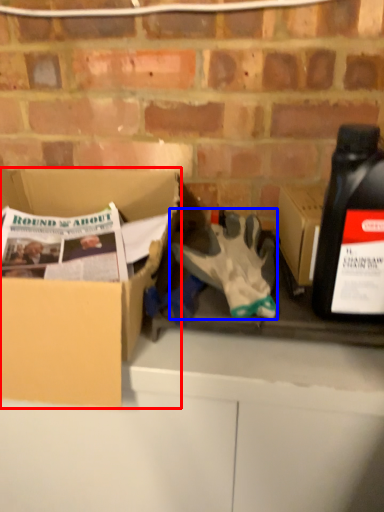
Question: Which of the following is the farthest to the observer, box (highlighted by a red box) or glove (highlighted by a blue box)?

Choices:
 (A) box
 (B) glove

Answer: (B)